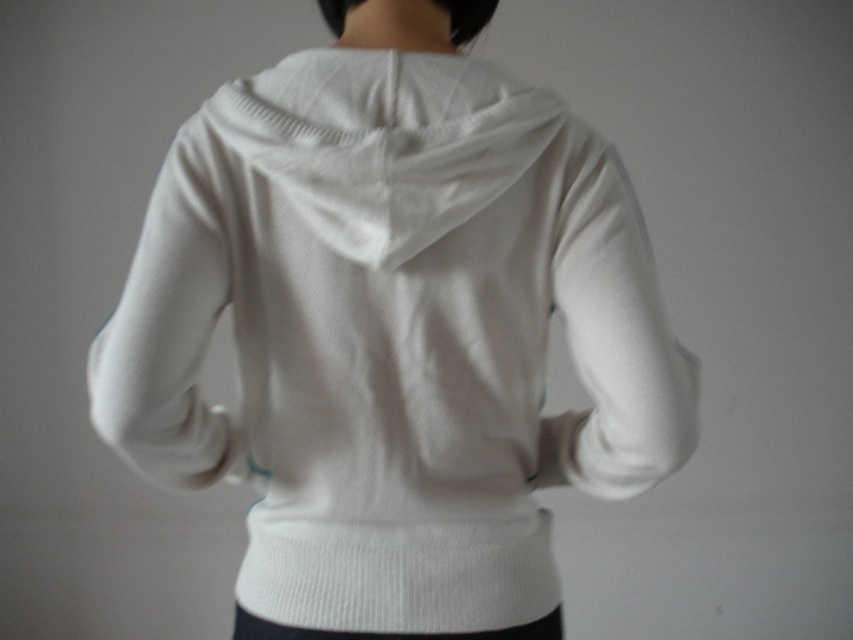
Between point (351, 465) and point (347, 150), which one is positioned behind?

The point (351, 465) is behind.

Locate an element on the screen. Image resolution: width=853 pixels, height=640 pixels. white knitted sweater at center is located at coordinates click(393, 332).

The height and width of the screenshot is (640, 853). In order to click on white knitted sweater at center in this screenshot , I will do click(393, 332).